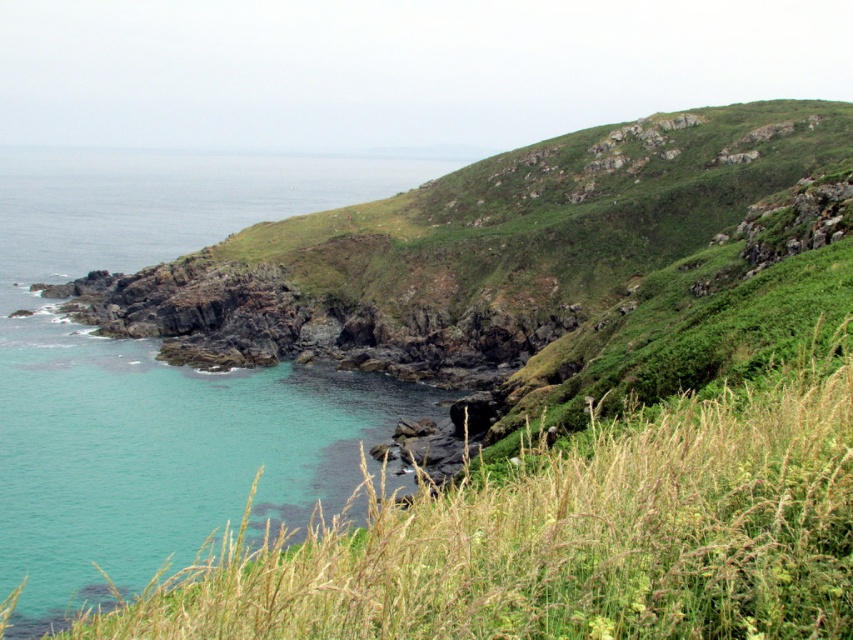
Which is below, green grassy at lower left or turquoise water at left?

green grassy at lower left is below.

Is green grassy at lower left bigger than turquoise water at left?

Actually, green grassy at lower left might be smaller than turquoise water at left.

Measure the distance between point (828,556) and camera.

7.96 meters

Identify the location of green grassy at lower left. The image size is (853, 640). (570, 536).